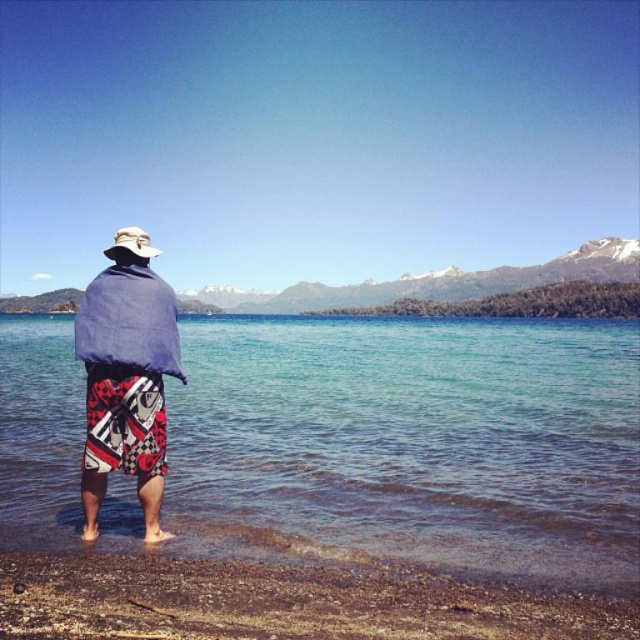
Locate an element on the screen. The width and height of the screenshot is (640, 640). blue cotton robe at center is located at coordinates (125, 368).

Can you confirm if blue cotton robe at center is positioned to the left of snowy rock mountain at upper center?

In fact, blue cotton robe at center is to the right of snowy rock mountain at upper center.

The height and width of the screenshot is (640, 640). In order to click on blue cotton robe at center in this screenshot , I will do `click(125, 368)`.

The height and width of the screenshot is (640, 640). I want to click on blue cotton robe at center, so click(125, 368).

Does blue cotton robe at center have a lesser height compared to white fabric hat at upper center?

Indeed, blue cotton robe at center has a lesser height compared to white fabric hat at upper center.

Does blue cotton robe at center have a lesser width compared to white fabric hat at upper center?

Indeed, blue cotton robe at center has a lesser width compared to white fabric hat at upper center.

Identify the location of blue cotton robe at center. The height and width of the screenshot is (640, 640). (125, 368).

Can you confirm if clear water at lower center is positioned to the left of blue cotton robe at center?

In fact, clear water at lower center is to the right of blue cotton robe at center.

Is clear water at lower center below blue cotton robe at center?

Yes, clear water at lower center is below blue cotton robe at center.

Who is more forward, (360, 390) or (118, 260)?

Positioned in front is point (118, 260).

You are a GUI agent. You are given a task and a screenshot of the screen. Output one action in this format:
    pyautogui.click(x=<x>, y=<y>)
    Task: Click on the clear water at lower center
    The width and height of the screenshot is (640, 640).
    Given the screenshot: What is the action you would take?
    pyautogui.click(x=410, y=442)